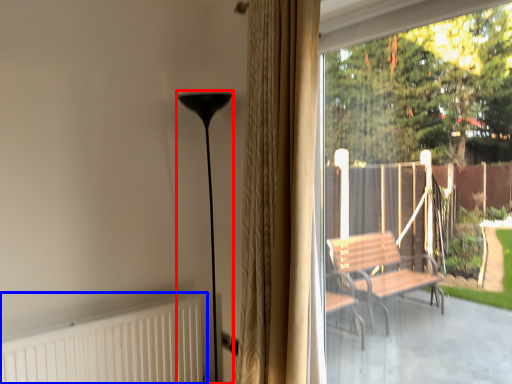
Question: Which point is further to the camera, lamp (highlighted by a red box) or radiator (highlighted by a blue box)?

Choices:
 (A) lamp
 (B) radiator

Answer: (A)